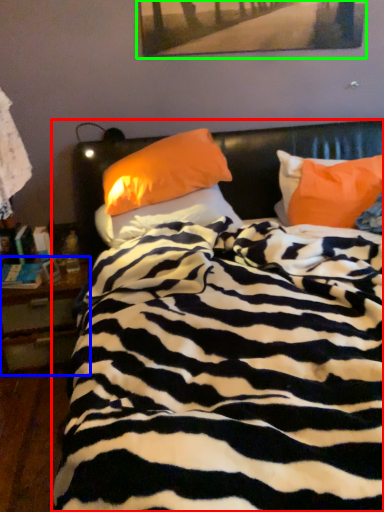
Question: Considering the real-world distances, which object is closest to bed (highlighted by a red box)? nightstand (highlighted by a blue box) or picture frame (highlighted by a green box).

Choices:
 (A) nightstand
 (B) picture frame

Answer: (A)